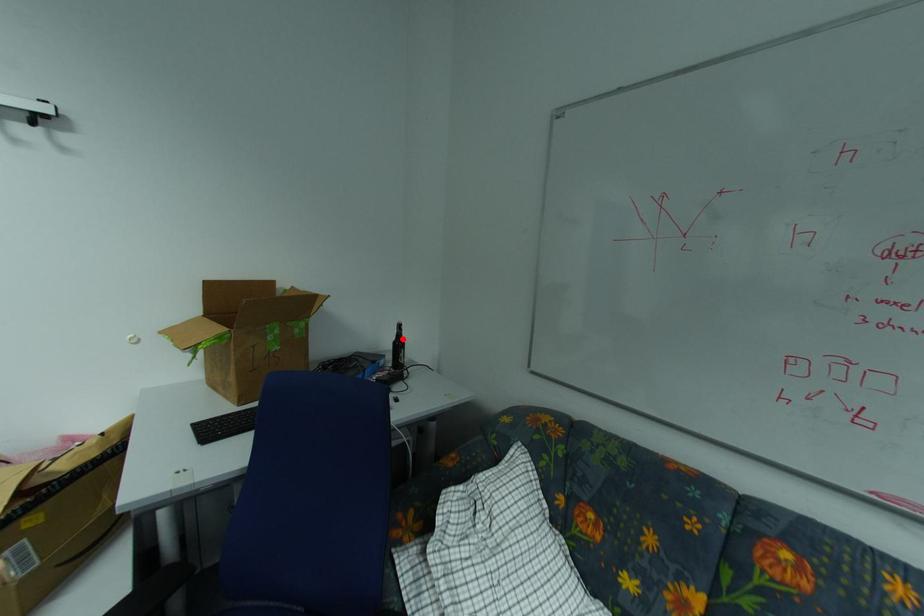
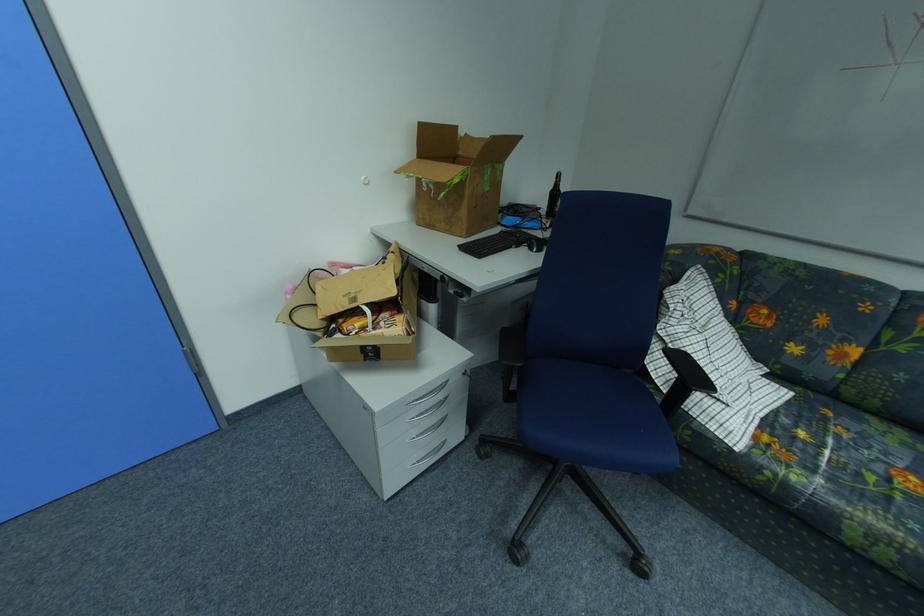
Locate, in the second image, the point that corresponds to the highlighted location in the first image.

(560, 188)